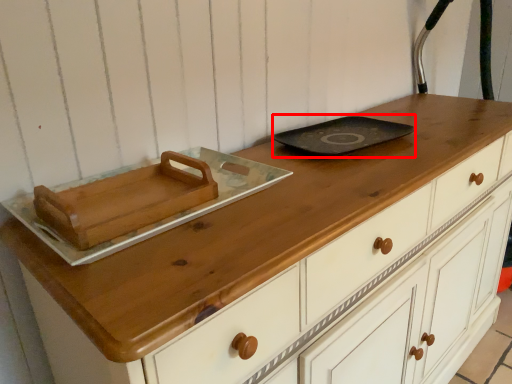
Question: From the image's perspective, what is the correct spatial positioning of frying pan (annotated by the red box) in reference to food?

Choices:
 (A) above
 (B) below

Answer: (A)